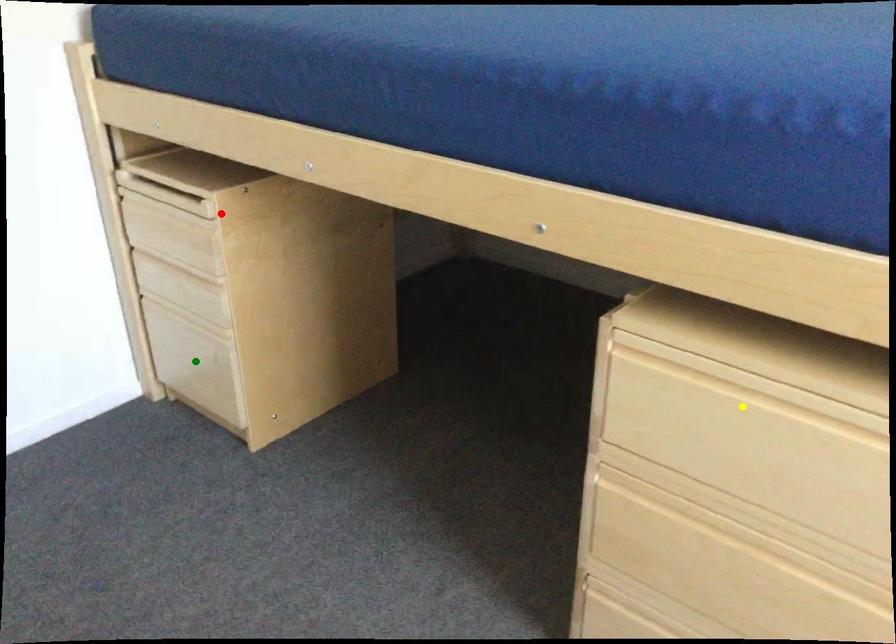
Looking at this image, order these from nearest to farthest:
A) red point
B) green point
C) yellow point

1. yellow point
2. red point
3. green point